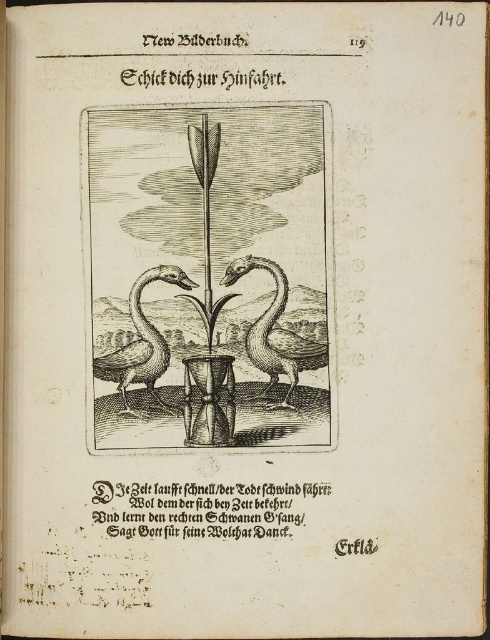
In the scene shown: You are an art restorer examining the page from an old book. You need to determine if the smooth silver swan at center and the gray wood swan at left can both fit on a display shelf that is 1 meter wide. Given their widths, will they fit together?

The smooth silver swan at center is wider than the gray wood swan at left, but since the total width of both swans combined is not provided, it is impossible to determine if they will fit on the 1 meter wide shelf without additional information.

You are an archer aiming to hit the center of the vase between the two swans. The arrows are currently pointing towards the point marked at coordinates point [288,364]. If you want to adjust your aim to hit the center of the vase, which is 3.53 feet away from the current arrow points, in which direction should you move your aim?

The arrows are currently pointing towards the point marked at coordinates point [288,364]. To hit the center of the vase, you need to adjust your aim by moving it 3.53 feet towards the center of the vase from the current arrow points.

You are an archer aiming to hit the target behind the two points. Given the positions of point (256, 145) and point (174, 282), which point should you avoid shooting through to ensure your arrow reaches the target beyond?

You should avoid shooting through point (256, 145) because it is in front of point (174, 282), so an arrow passing through point (256, 145) would block the path to the target behind.